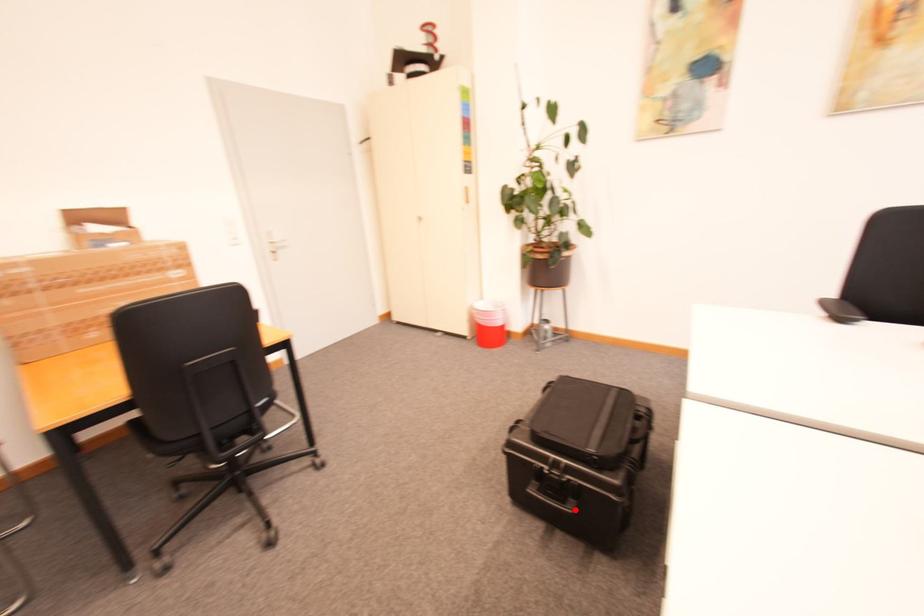
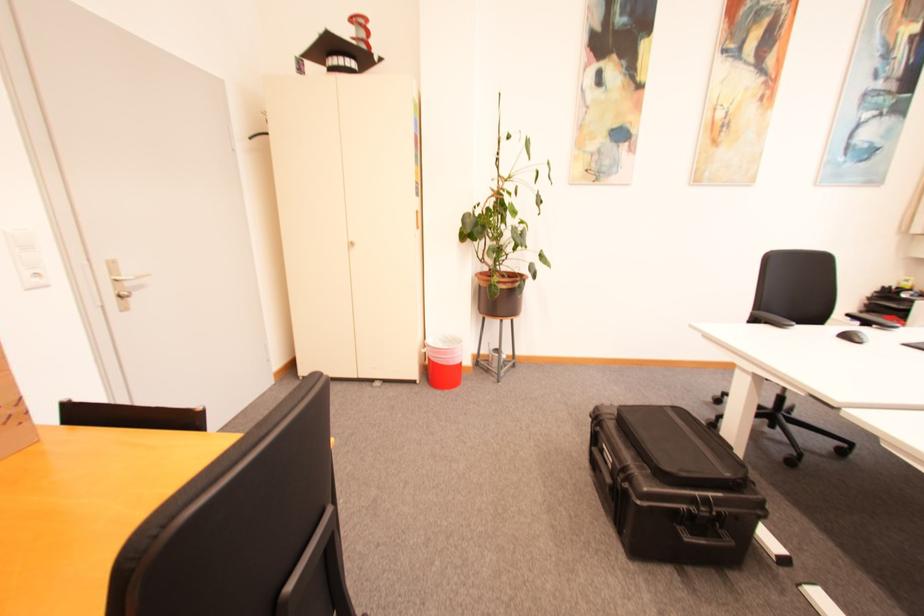
Question: I am providing you with two images of the same scene from different viewpoints. In image1, a red point is highlighted. Considering the same 3D point in image2, which of the following is correct?

Choices:
 (A) It is closer
 (B) It is farther

Answer: (A)